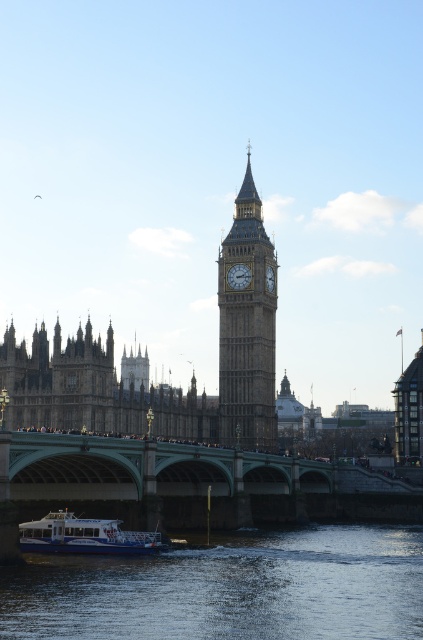
Which is in front, point (359, 595) or point (227, 397)?

Point (359, 595) is more forward.

Locate an element on the screen. blue water at lower center is located at coordinates (227, 588).

You are a GUI agent. You are given a task and a screenshot of the screen. Output one action in this format:
    pyautogui.click(x=<x>, y=<y>)
    Task: Click on the blue water at lower center
    The image size is (423, 640).
    Given the screenshot: What is the action you would take?
    (x=227, y=588)

Is golden stone clock tower at center above white glossy boat at lower left?

Correct, golden stone clock tower at center is located above white glossy boat at lower left.

Is golden stone clock tower at center positioned at the back of white glossy boat at lower left?

That is True.

Locate an element on the screen. The height and width of the screenshot is (640, 423). golden stone clock tower at center is located at coordinates [x=247, y=326].

Between blue water at lower center and white glossy boat at lower left, which one is positioned higher?

Positioned higher is white glossy boat at lower left.

Which is more to the right, blue water at lower center or white glossy boat at lower left?

Positioned to the right is blue water at lower center.

Which is behind, point (321, 557) or point (32, 525)?

The point (321, 557) is more distant.

Where is `blue water at lower center`? This screenshot has width=423, height=640. blue water at lower center is located at coordinates (227, 588).